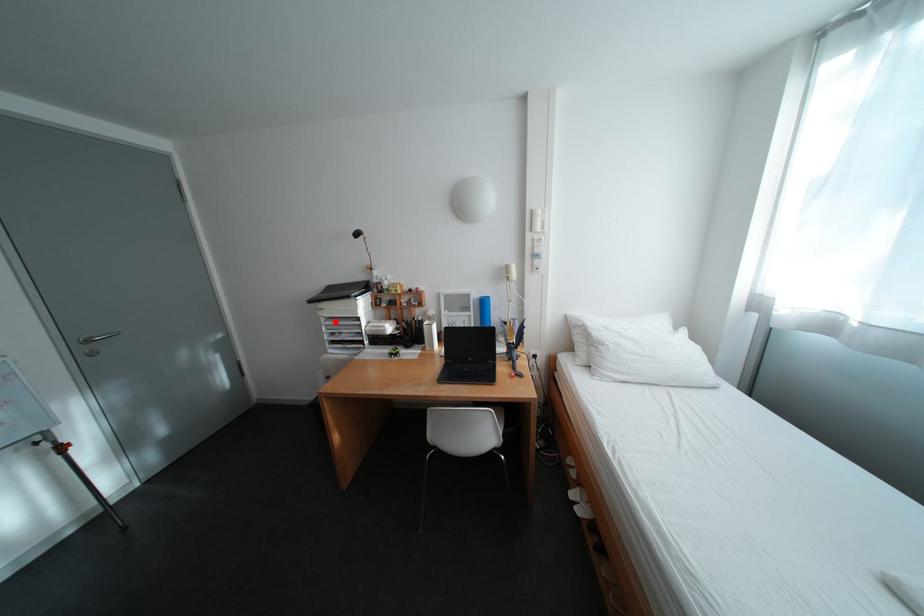
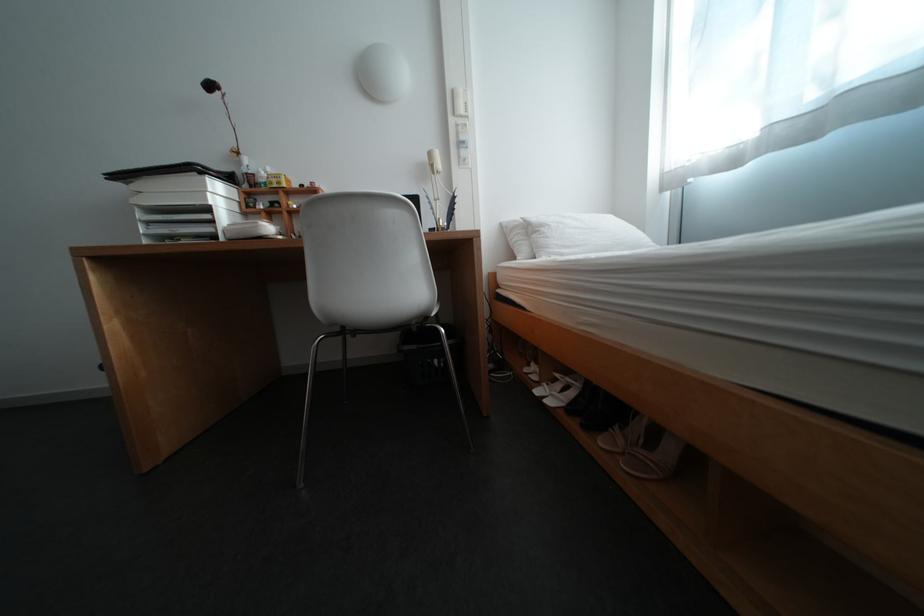
Find the pixel in the second image that matches the highlighted location in the first image.

(152, 217)